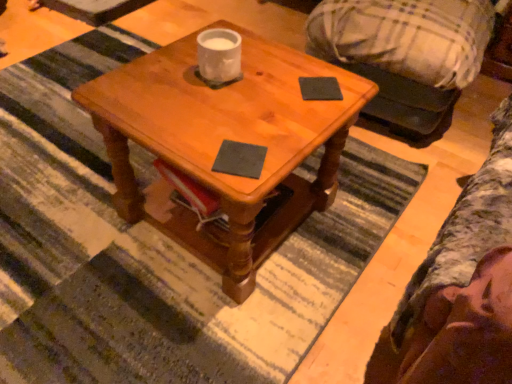
The height and width of the screenshot is (384, 512). Identify the location of unoccupied space behind dark gray matte notepad at center, which is the second notepad from top to bottom. (248, 115).